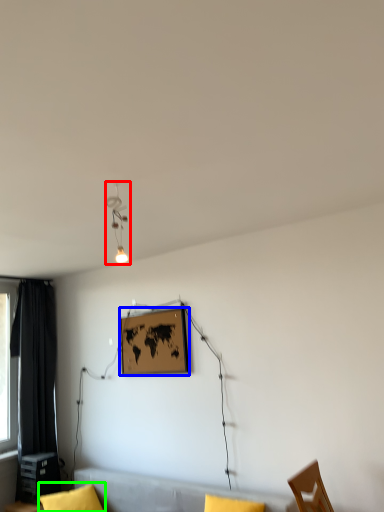
Question: Which is nearer to the lamp (highlighted by a red box)? picture frame (highlighted by a blue box) or pillow (highlighted by a green box).

Choices:
 (A) picture frame
 (B) pillow

Answer: (A)